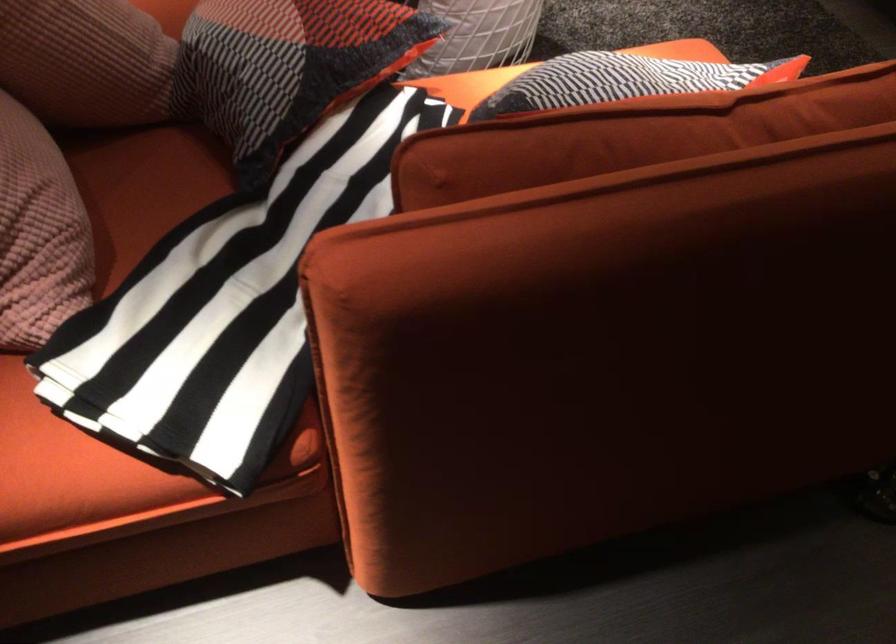
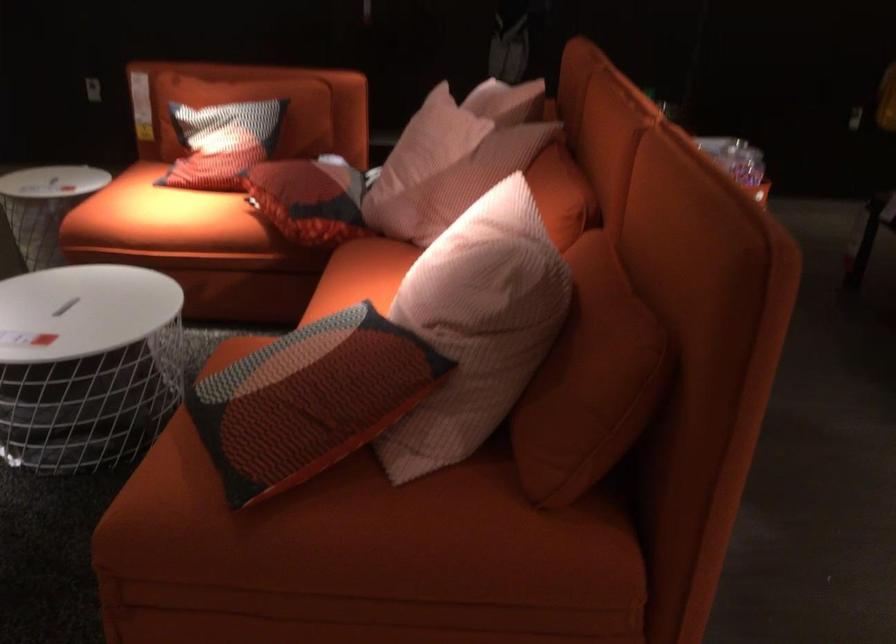
Question: I am providing you with two images of the same scene from different viewpoints. Please identify which objects are invisible in image2.

Choices:
 (A) white wire basket
 (B) red patterned pillow
 (C) wooden shutter
 (D) pink striped pillow

Answer: (A)